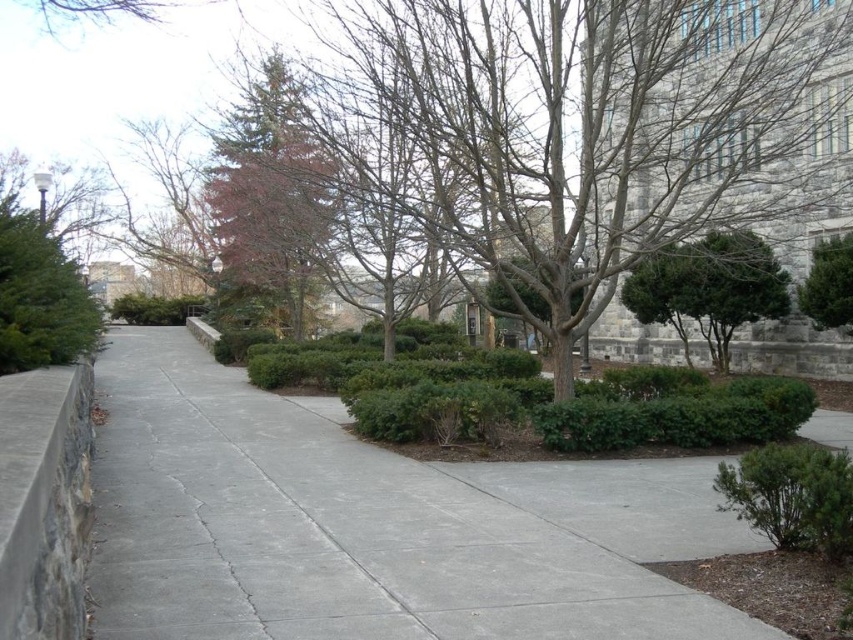
Consider the image. Between green textured shrub at center right and green leafy bush at right, which one is positioned higher?

green leafy bush at right

Does point (680, 272) come behind point (843, 310)?

Yes, point (680, 272) is farther from viewer.

You are a GUI agent. You are given a task and a screenshot of the screen. Output one action in this format:
    pyautogui.click(x=<x>, y=<y>)
    Task: Click on the green textured shrub at center right
    
    Given the screenshot: What is the action you would take?
    pyautogui.click(x=708, y=289)

Consider the image. Does green textured shrub at center right appear over green matte shrub at lower right?

Yes, green textured shrub at center right is above green matte shrub at lower right.

What do you see at coordinates (708, 289) in the screenshot?
I see `green textured shrub at center right` at bounding box center [708, 289].

The width and height of the screenshot is (853, 640). In order to click on green textured shrub at center right in this screenshot , I will do `click(708, 289)`.

Does green matte tree at upper center come behind green leafy bush at right?

No, green matte tree at upper center is closer to the viewer.

Can you confirm if green matte tree at upper center is smaller than green leafy bush at right?

No.

Describe the element at coordinates (271, 189) in the screenshot. This screenshot has height=640, width=853. I see `green matte tree at upper center` at that location.

Identify the location of green matte tree at upper center. (271, 189).